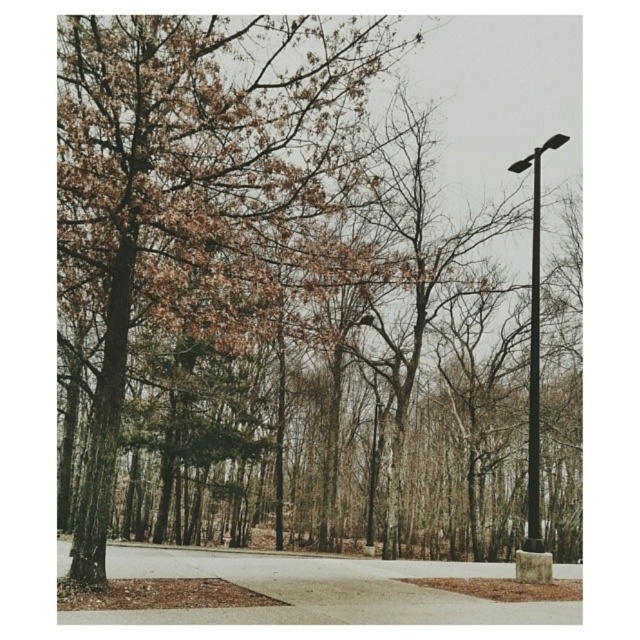
You are a landscape architect designing a garden and want to place a new bench between the brown wood tree at center and the smooth black pole at center. Which object should the bench be closer to if you want it to be closer to the taller object?

The bench should be placed closer to the smooth black pole at center because it is taller than the brown wood tree at center.

You are standing at the point with coordinates point [68,29] and want to walk to point [369,518]. Which direction should you move to get closer to your destination?

You should move away from the camera because point [369,518] is further from the camera than point [68,29].

You are a maintenance worker who needs to replace a light bulb on the black metal street light at right and the black metal pole at right. Which object requires you to climb higher to reach the light?

The black metal street light at right requires climbing higher because it is much taller than the black metal pole at right.